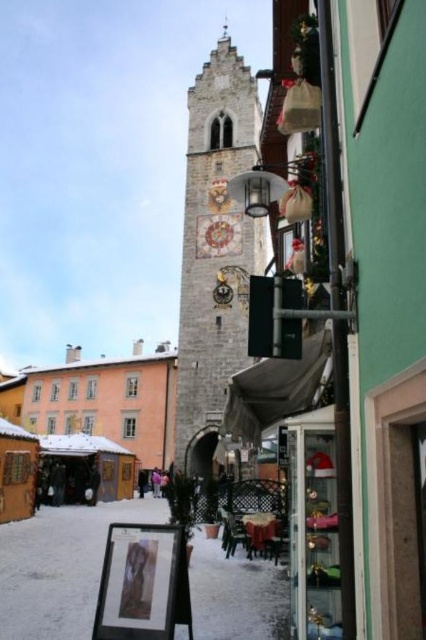
Question: Is stone clock tower at center positioned behind orange matte building at center?

Choices:
 (A) yes
 (B) no

Answer: (B)

Question: Can you confirm if stone clock tower at center is positioned above orange matte building at center?

Choices:
 (A) yes
 (B) no

Answer: (A)

Question: Which of the following is the closest to the observer?

Choices:
 (A) (250, 220)
 (B) (124, 412)

Answer: (A)

Question: Considering the relative positions of stone clock tower at center and orange matte building at center in the image provided, where is stone clock tower at center located with respect to orange matte building at center?

Choices:
 (A) right
 (B) left

Answer: (A)

Question: Which point is closer to the camera?

Choices:
 (A) (146, 364)
 (B) (250, 88)

Answer: (B)

Question: Which point appears closest to the camera in this image?

Choices:
 (A) (164, 353)
 (B) (241, 326)

Answer: (B)